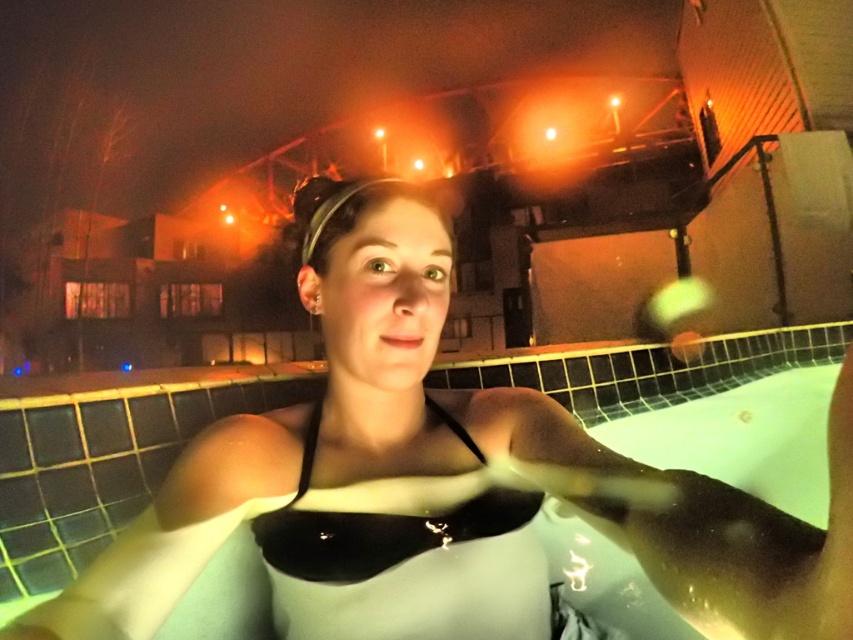
You are a photographer at the poolside and want to capture a photo of both the white matte swimsuit at center and the black matte bikini top at center. Which swimsuit should you focus on first if you want to start from the left side of the scene?

The black matte bikini top at center should be focused on first since it is positioned to the left of the white matte swimsuit at center.

You are a photographer trying to capture the best shot of the white matte swimsuit at center and the black matte bikini top at center. Which one is closer to the camera?

The white matte swimsuit at center is positioned under the black matte bikini top at center, so the black matte bikini top at center is closer to the camera.

Consider the image. You are a photographer trying to capture the perfect shot of the white matte swimsuit at center. Given the coordinates provided, where should you position your camera to ensure the swimsuit is centered in the frame?

The white matte swimsuit at center is located at coordinates point (450, 477), so positioning the camera directly facing this point will ensure the swimsuit is centered in the frame.